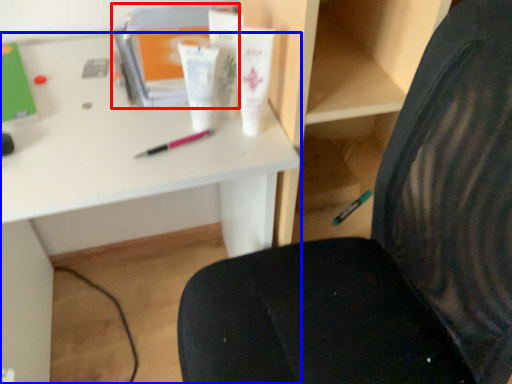
Question: Which point is further to the camera, book (highlighted by a red box) or desk (highlighted by a blue box)?

Choices:
 (A) book
 (B) desk

Answer: (A)